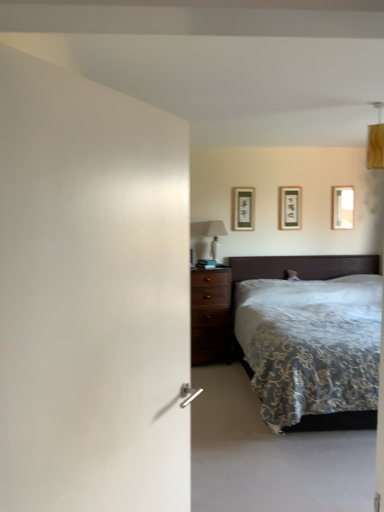
Question: Is matte black picture frame at upper center, the 2th picture frame positioned from the right, looking in the opposite direction of velvet dark brown bed at right?

Choices:
 (A) yes
 (B) no

Answer: (B)

Question: Is matte black picture frame at upper center, the 2th picture frame positioned from the right, outside of velvet dark brown bed at right?

Choices:
 (A) yes
 (B) no

Answer: (A)

Question: Is matte black picture frame at upper center, the second picture frame in the left-to-right sequence, bigger than velvet dark brown bed at right?

Choices:
 (A) yes
 (B) no

Answer: (B)

Question: Does matte black picture frame at upper center, the second picture frame in the left-to-right sequence, contain velvet dark brown bed at right?

Choices:
 (A) no
 (B) yes

Answer: (A)

Question: Can you confirm if matte black picture frame at upper center, the 2th picture frame positioned from the right, is shorter than velvet dark brown bed at right?

Choices:
 (A) yes
 (B) no

Answer: (A)

Question: Is point (215, 251) closer or farther from the camera than point (332, 202)?

Choices:
 (A) farther
 (B) closer

Answer: (B)

Question: Relative to wooden picture frame at upper right, acting as the first picture frame starting from the right, is white glossy table lamp at upper center in front or behind?

Choices:
 (A) behind
 (B) front

Answer: (B)

Question: Looking at the image, does white glossy table lamp at upper center seem bigger or smaller compared to wooden picture frame at upper right, which is counted as the 3th picture frame, starting from the left?

Choices:
 (A) big
 (B) small

Answer: (A)

Question: Looking at their shapes, would you say white glossy table lamp at upper center is wider or thinner than wooden picture frame at upper right, which is counted as the 3th picture frame, starting from the left?

Choices:
 (A) thin
 (B) wide

Answer: (B)

Question: From a real-world perspective, relative to matte black picture frame at upper center, the second picture frame in the left-to-right sequence, is wooden picture frame at upper right, which is counted as the 3th picture frame, starting from the left, vertically above or below?

Choices:
 (A) below
 (B) above

Answer: (A)

Question: From the image's perspective, is wooden picture frame at upper right, which is counted as the 3th picture frame, starting from the left, located above or below matte black picture frame at upper center, the 2th picture frame positioned from the right?

Choices:
 (A) above
 (B) below

Answer: (A)

Question: Is wooden picture frame at upper right, acting as the first picture frame starting from the right, in front of or behind matte black picture frame at upper center, the second picture frame in the left-to-right sequence, in the image?

Choices:
 (A) front
 (B) behind

Answer: (B)

Question: From their relative heights in the image, would you say wooden picture frame at upper right, acting as the first picture frame starting from the right, is taller or shorter than matte black picture frame at upper center, the second picture frame in the left-to-right sequence?

Choices:
 (A) short
 (B) tall

Answer: (A)

Question: Is velvet dark brown bed at right taller or shorter than white glossy table lamp at upper center?

Choices:
 (A) short
 (B) tall

Answer: (B)

Question: Is velvet dark brown bed at right in front of or behind white glossy table lamp at upper center in the image?

Choices:
 (A) behind
 (B) front

Answer: (B)